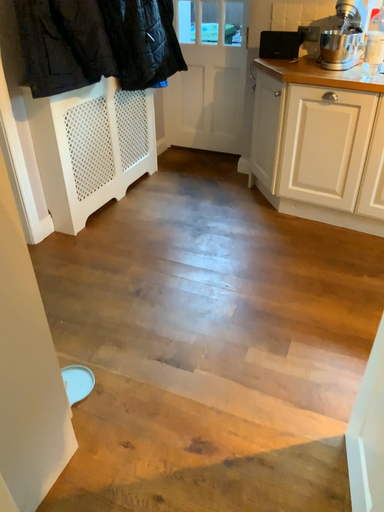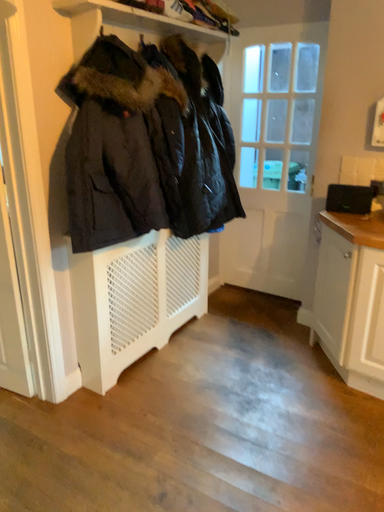
Question: Which way did the camera rotate in the video?

Choices:
 (A) rotated right
 (B) rotated left

Answer: (B)